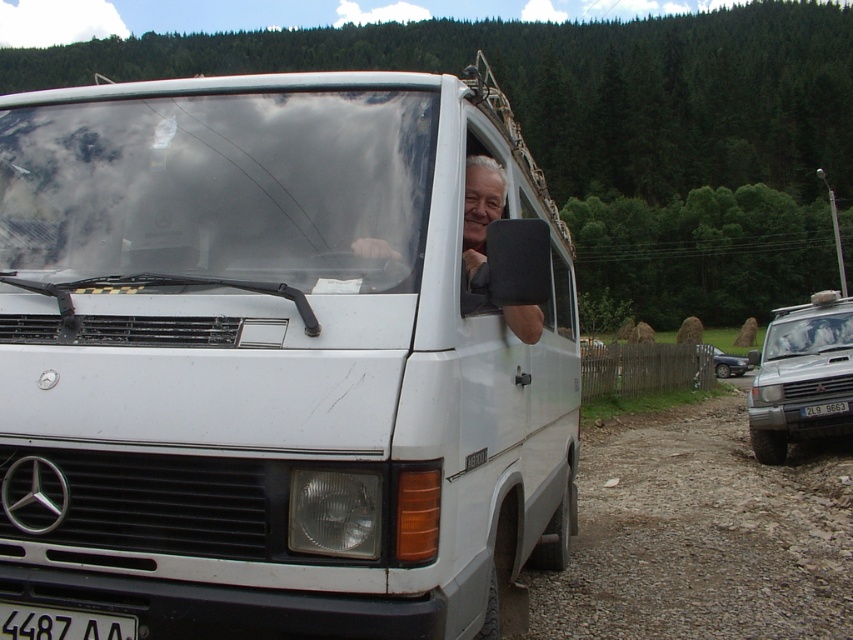
You are standing at the center of the image and want to move towards the silver metallic suv at right. Which direction should you go?

The silver metallic suv at right is located at point 0.586 on the x and 0.940 on the y, so you should move towards the right and slightly downward to reach it.

Based on the scene description, can you determine the relative positions of the silver metallic suv at right and the black plastic license plate at center? Which one is positioned to the right?

The silver metallic suv at right is positioned to the right of the black plastic license plate at center.

You are a delivery driver who needs to park your white matte van at center in a parking spot that is 20 feet long. The parking spot has a black plastic license plate at center at the front. Will your van fit in the parking spot without overhanging the license plate?

The white matte van at center and the black plastic license plate at center are 20.50 feet apart. Since the parking spot is only 20 feet long, the van will overhang the license plate by 0.50 feet.